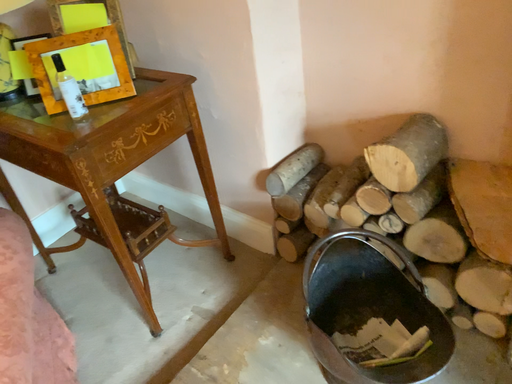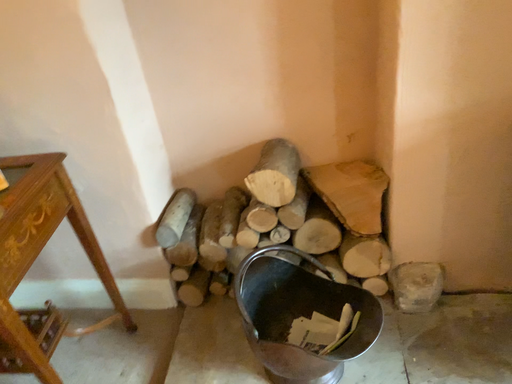
Question: Which way did the camera rotate in the video?

Choices:
 (A) rotated left
 (B) rotated right

Answer: (B)